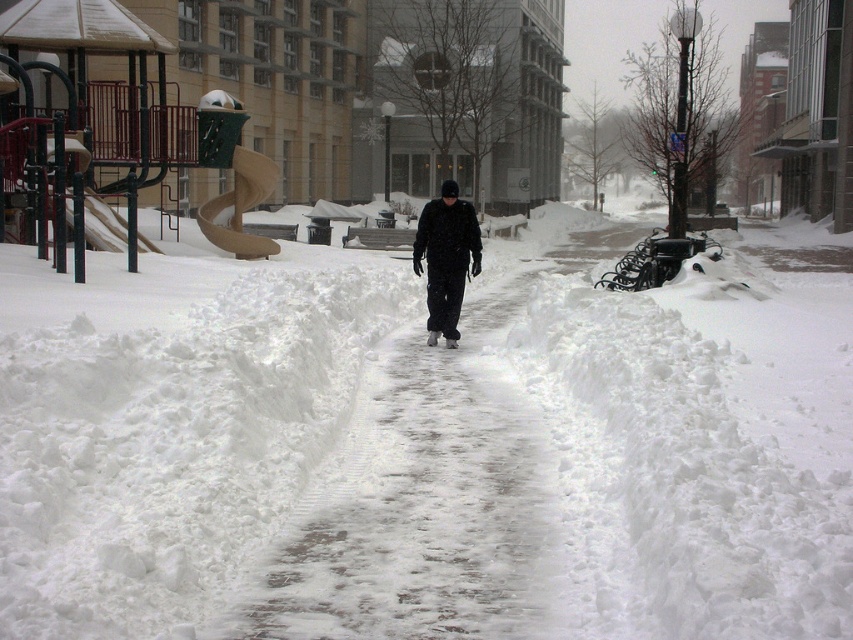
Question: Can you confirm if white icy sidewalk at center is thinner than black matte jacket at center?

Choices:
 (A) no
 (B) yes

Answer: (A)

Question: Does white fluffy snow at center appear on the right side of white icy sidewalk at center?

Choices:
 (A) no
 (B) yes

Answer: (B)

Question: Estimate the real-world distances between objects in this image. Which object is farther from the black matte jacket at center?

Choices:
 (A) white icy sidewalk at center
 (B) white fluffy snow at center

Answer: (B)

Question: Among these objects, which one is nearest to the camera?

Choices:
 (A) white icy sidewalk at center
 (B) white fluffy snow at center
 (C) black matte jacket at center

Answer: (B)

Question: Does white fluffy snow at center appear over black matte jacket at center?

Choices:
 (A) yes
 (B) no

Answer: (B)

Question: Among these points, which one is nearest to the camera?

Choices:
 (A) (508, 294)
 (B) (314, 484)
 (C) (440, 330)

Answer: (B)